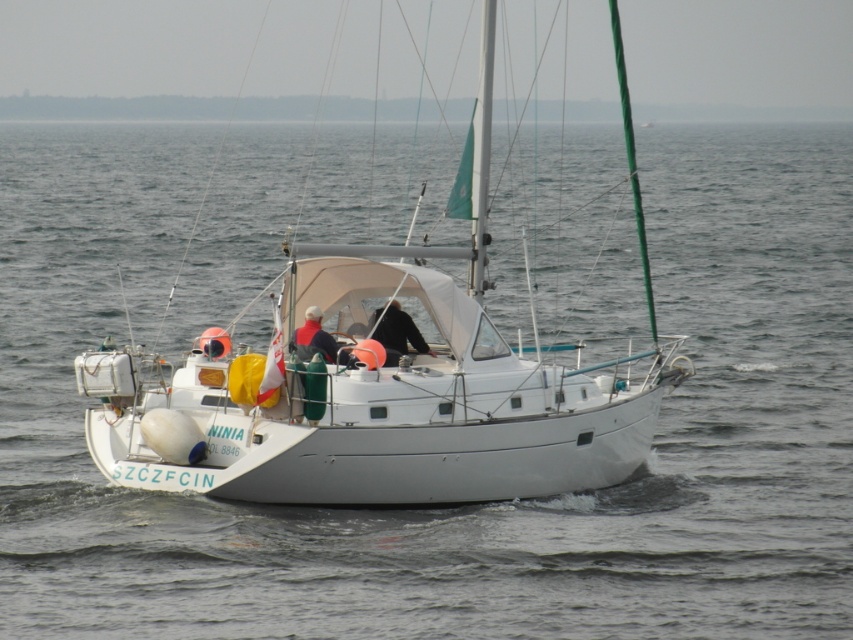
Which of these two, white matte sailboat at center or white matte jacket at center, stands shorter?

Standing shorter between the two is white matte jacket at center.

Is point (364, 400) positioned before point (300, 356)?

Yes, it is in front of point (300, 356).

This screenshot has width=853, height=640. What are the coordinates of `white matte sailboat at center` in the screenshot? It's located at pyautogui.click(x=383, y=381).

Can you confirm if white matte sailboat at center is thinner than black fabric jacket at center?

No, white matte sailboat at center is not thinner than black fabric jacket at center.

The width and height of the screenshot is (853, 640). What are the coordinates of `white matte sailboat at center` in the screenshot? It's located at [x=383, y=381].

Locate an element on the screen. white matte sailboat at center is located at coordinates (383, 381).

In the scene shown: Who is positioned more to the right, black fabric jacket at center or white matte jacket at center?

From the viewer's perspective, black fabric jacket at center appears more on the right side.

Between black fabric jacket at center and white matte jacket at center, which one is positioned lower?

white matte jacket at center

Based on the photo, who is more distant from viewer, (393, 333) or (323, 332)?

Positioned behind is point (323, 332).

Find the location of a particular element. This screenshot has width=853, height=640. black fabric jacket at center is located at coordinates (395, 332).